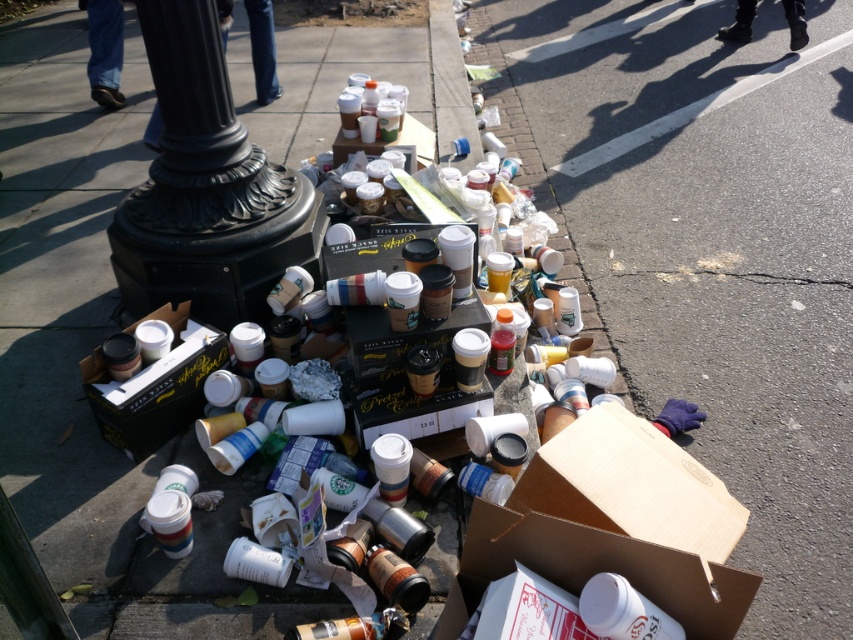
You are standing at the point labeled point [714,257]. Looking around, you see a cardboard box at lower right. What is the nearest object to you?

The nearest object to you is the cardboard box at lower right because the point [714,257] is on it.

You are a sanitation worker tasked with cleaning up the sidewalk. You need to move the cardboard box at lower right and the matte black box at lower left into a trash bin that is 6 feet away from the nearest box. Can both boxes be placed into the bin without moving them further than necessary?

The distance between the cardboard box at lower right and the matte black box at lower left is 5.99 feet. Since the trash bin is 6 feet away from the nearest box, the farthest box is only 5.99 feet away from the nearest one. Therefore, both boxes can be placed into the bin without needing to move them further than necessary.